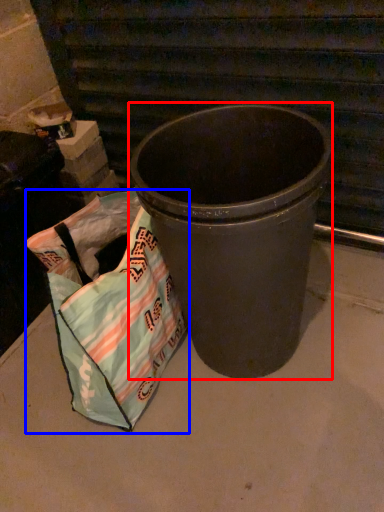
Question: Among these objects, which one is nearest to the camera, waste container (highlighted by a red box) or grocery bag (highlighted by a blue box)?

Choices:
 (A) waste container
 (B) grocery bag

Answer: (A)